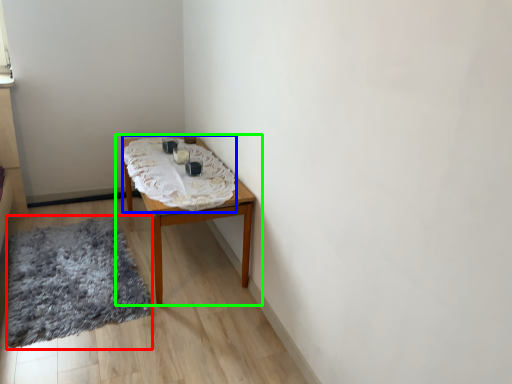
Question: Which object is the closest to the mat (highlighted by a red box)? Choose among these: blanket (highlighted by a blue box) or table (highlighted by a green box).

Choices:
 (A) blanket
 (B) table

Answer: (B)